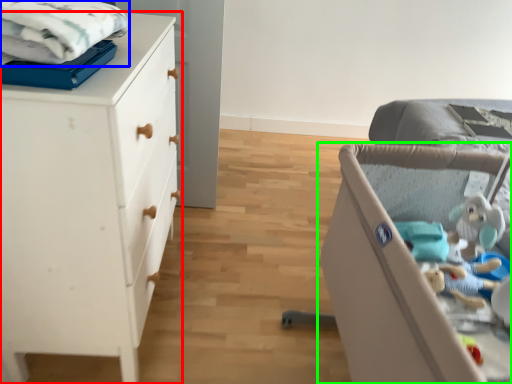
Question: Estimate the real-world distances between objects in this image. Which object is farther from chest of drawers (highlighted by a red box), cloth (highlighted by a blue box) or infant bed (highlighted by a green box)?

Choices:
 (A) cloth
 (B) infant bed

Answer: (B)